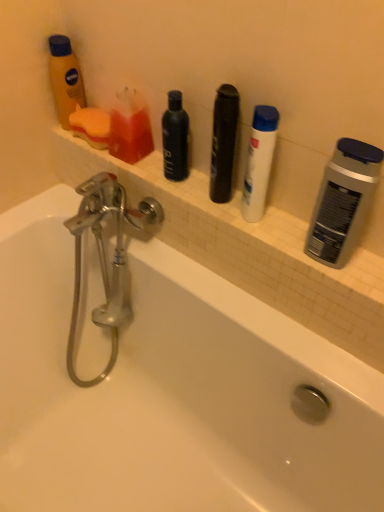
The image size is (384, 512). In order to click on empty space that is in between white matte shampoo at center, positioned as the first toiletry in right-to-left order, and silver metallic deodorant at right, arranged as the first personal care when viewed from the front in this screenshot , I will do `click(276, 230)`.